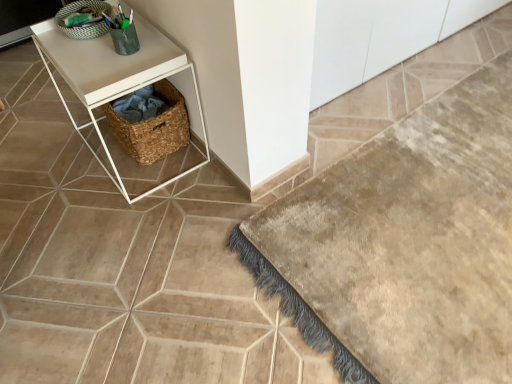
Question: Is woven basket at lower left inside the boundaries of white matte side table at upper left, or outside?

Choices:
 (A) outside
 (B) inside

Answer: (B)

Question: From the image's perspective, is woven basket at lower left positioned above or below white matte side table at upper left?

Choices:
 (A) above
 (B) below

Answer: (A)

Question: Which of these objects is positioned farthest from the white matte cabinet at upper center?

Choices:
 (A) white matte side table at upper left
 (B) woven brown basket at center, which is counted as the 1th basket, starting from the bottom
 (C) woven basket at lower left
 (D) green woven basket at upper left, the 2th basket from the bottom
 (E) beige plush bath mat at lower right

Answer: (D)

Question: Which object is positioned farthest from the white matte cabinet at upper center?

Choices:
 (A) woven basket at lower left
 (B) woven brown basket at center, which is counted as the 1th basket, starting from the bottom
 (C) beige plush bath mat at lower right
 (D) green woven basket at upper left, the 2th basket from the bottom
 (E) white matte side table at upper left

Answer: (D)